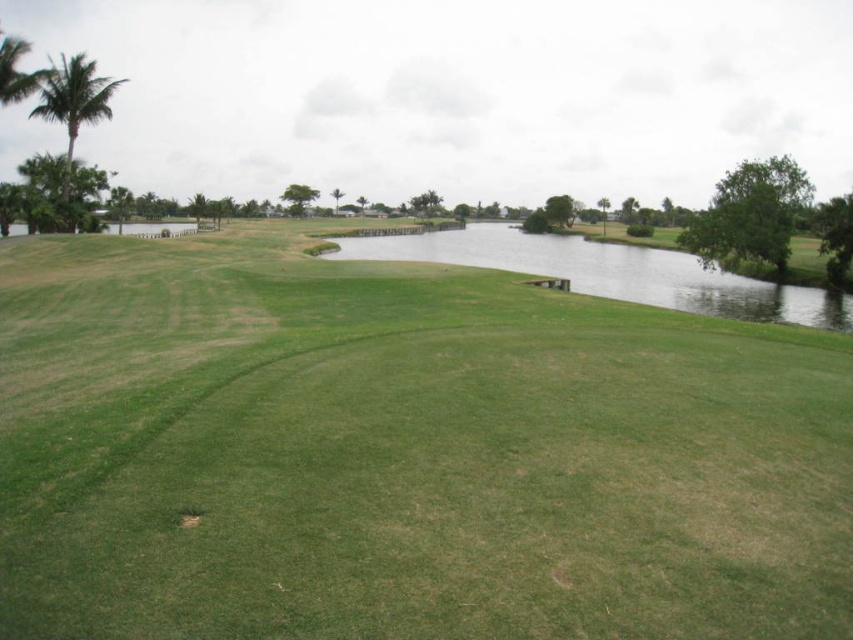
You are a golfer standing at the edge of the green grassy golf course at center. You want to hit a ball to the green leafy palm tree at upper left. Considering the distance between them, is it possible to reach the palm tree with a standard golf club that has a maximum distance of 200 feet?

The green grassy golf course at center is 201.03 feet from the green leafy palm tree at upper left. Since the maximum distance of the standard golf club is 200 feet, it is not possible to reach the palm tree with this club.

You are standing at the point marked as point (403, 454) on a golf course map. What is the name of the location you are currently at?

The location at point (403, 454) is the green grassy golf course at center.

You are a golfer standing on the green grassy golf course at center and want to hit a ball to the green grassy lake at center. Which direction should you hit the ball to reach the lake?

The green grassy lake at center is further away from the viewer compared to the green grassy golf course at center, so you should hit the ball away from yourself towards the lake.